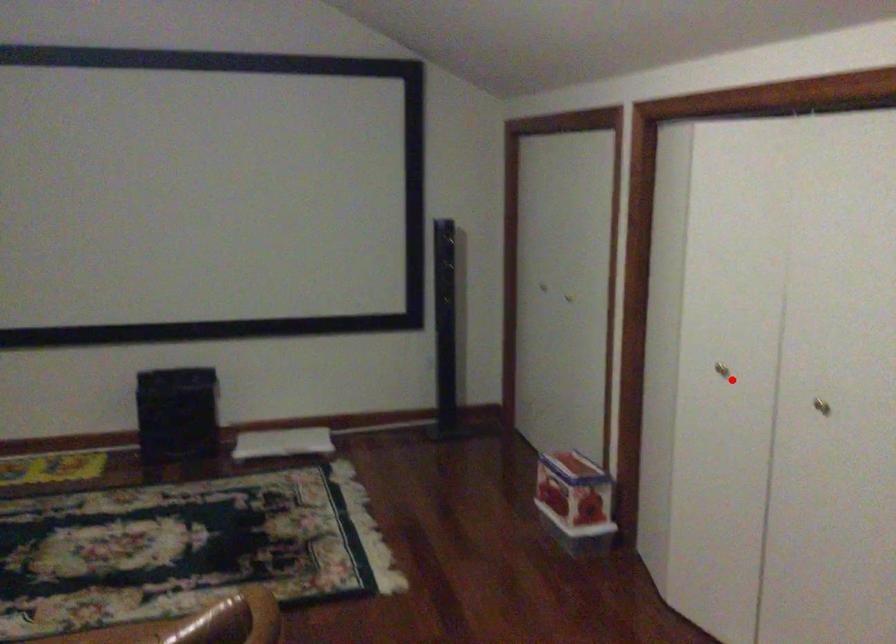
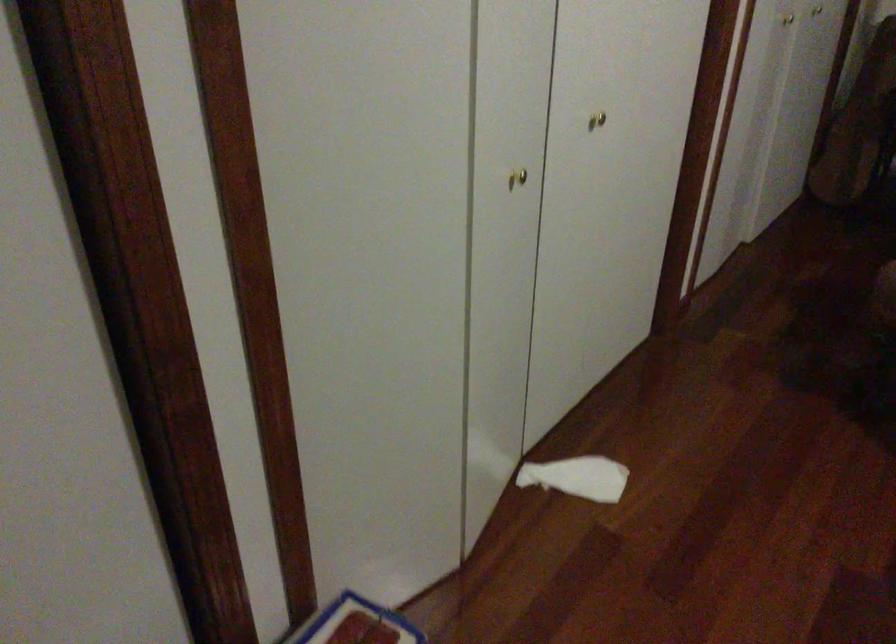
Find the pixel in the second image that matches the highlighted location in the first image.

(517, 178)